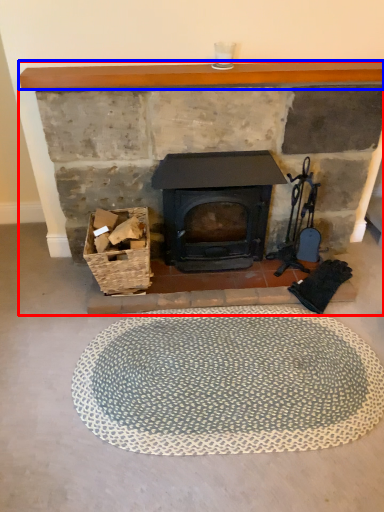
Question: Among these objects, which one is nearest to the camera, fireplace (highlighted by a red box) or balustrade (highlighted by a blue box)?

Choices:
 (A) fireplace
 (B) balustrade

Answer: (B)